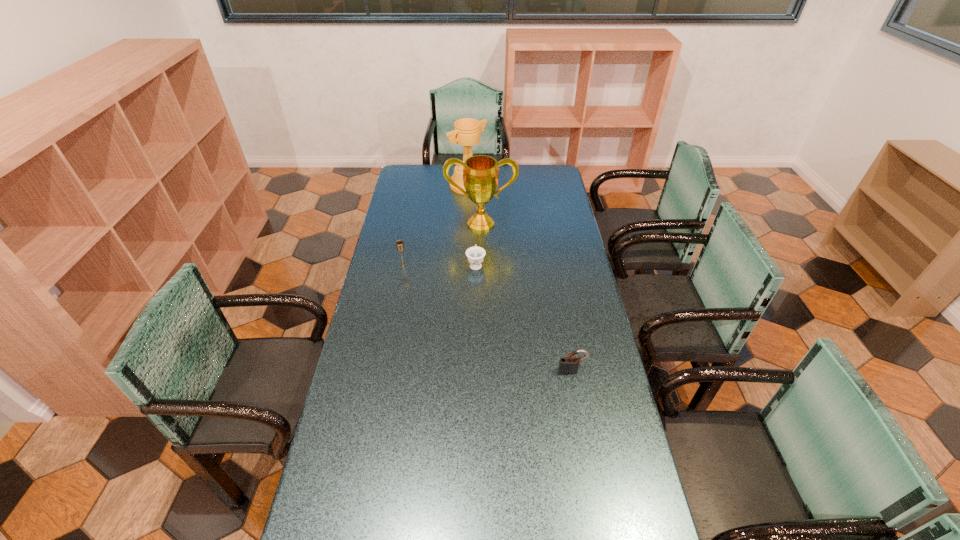
Find the location of a particular element. The image size is (960, 540). vacant space that's between the farther award and the padlock is located at coordinates (520, 278).

Identify the location of free space that is in between the padlock and the fourth nearest object. (526, 298).

Where is `empty space that is in between the chalice and the fourth nearest object`? Image resolution: width=960 pixels, height=540 pixels. empty space that is in between the chalice and the fourth nearest object is located at coordinates (442, 245).

Where is `vacant space that is in between the second farthest object and the leftmost object`? vacant space that is in between the second farthest object and the leftmost object is located at coordinates (442, 245).

Where is `free point between the fourth nearest object and the farther award`? The width and height of the screenshot is (960, 540). free point between the fourth nearest object and the farther award is located at coordinates (474, 204).

This screenshot has width=960, height=540. I want to click on unoccupied position between the chalice and the fourth nearest object, so click(x=442, y=245).

Locate an element on the screen. The width and height of the screenshot is (960, 540). the second closest object to the nearer award is located at coordinates (466, 133).

Identify which object is the second closest to the nearest object. Please provide its 2D coordinates. Your answer should be formatted as a tuple, i.e. [(x, y)], where the tuple contains the x and y coordinates of a point satisfying the conditions above.

[(480, 172)]

Locate an element on the screen. vacant area that satisfies the following two spatial constraints: 1. on the back side of the farther award; 2. on the left side of the leftmost object is located at coordinates (419, 185).